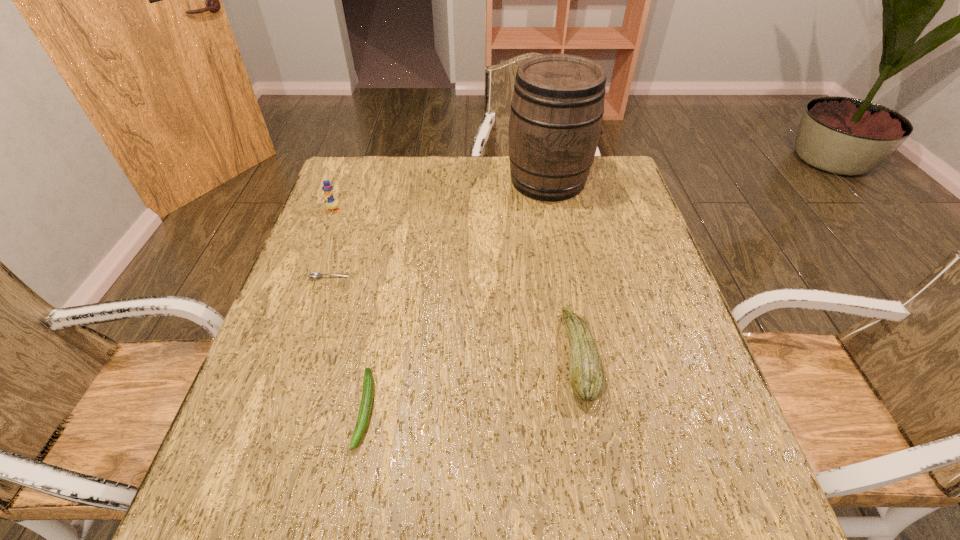
Identify the location of vacant space that satisfies the following two spatial constraints: 1. at the stem end of the right zucchini; 2. on the front-facing side of the shorter zucchini. (588, 409).

Locate an element on the screen. free location that satisfies the following two spatial constraints: 1. at the stem end of the third shortest object; 2. on the front-facing side of the shorter zucchini is located at coordinates (588, 409).

At what (x,y) coordinates should I click in order to perform the action: click on free location that satisfies the following two spatial constraints: 1. at the stem end of the third tallest object; 2. on the front-facing side of the fourth tallest object. Please return your answer as a coordinate pair (x, y). The height and width of the screenshot is (540, 960). Looking at the image, I should click on (588, 409).

You are a GUI agent. You are given a task and a screenshot of the screen. Output one action in this format:
    pyautogui.click(x=<x>, y=<y>)
    Task: Click on the vacant region that satisfies the following two spatial constraints: 1. on the back side of the tallest object; 2. on the right side of the third farthest object
    The image size is (960, 540).
    Given the screenshot: What is the action you would take?
    pyautogui.click(x=362, y=180)

In order to click on vacant space that satisfies the following two spatial constraints: 1. on the face of the second tallest object, where the monocle is placed; 2. on the left side of the shortest object in this screenshot , I will do `click(307, 278)`.